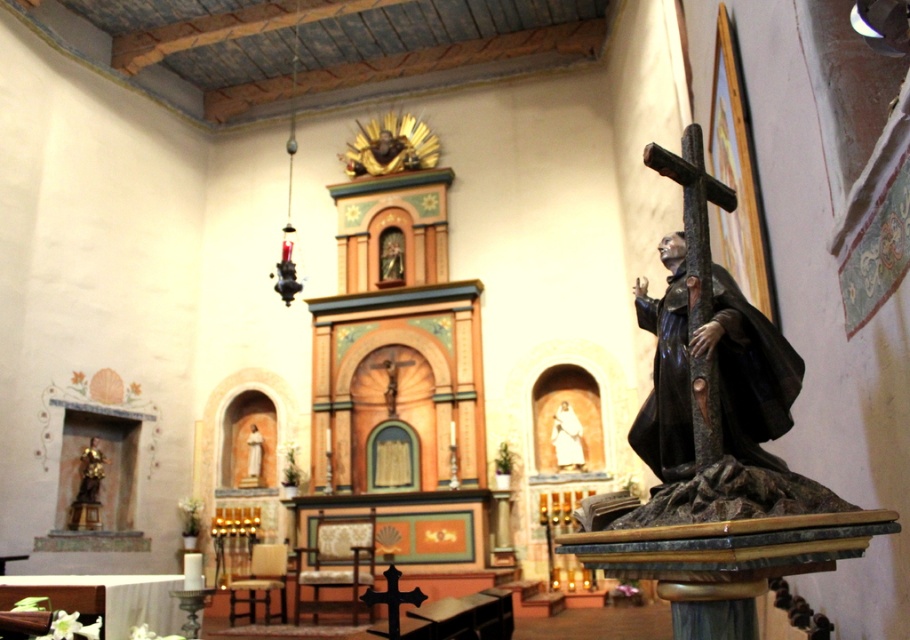
You are an interior designer planning to place a new decorative item in the church. You have a small statue that needs to fit between the polished dark wood statue at right and the gold leaf statue at upper center. Based on their sizes, which statue can you place closer to the new item without overcrowding the space?

The polished dark wood statue at right occupies less space than the gold leaf statue at upper center, so you can place the new item closer to the polished dark wood statue at right to avoid overcrowding.

You are standing in the center of the church and want to place a bouquet of flowers directly in front of the polished dark wood statue at right. Based on the statue

The polished dark wood statue at right is located at point [749,372], so you should place the bouquet of flowers at the coordinates closest to this point to position it directly in front of the statue.

You are an interior designer planning to place a new decorative item in the church. You have two options from the scene, the white cloth figure at center and the smooth white statue at center. If you want to choose the bigger one for a prominent display, which should you select?

The white cloth figure at center is larger in size than the smooth white statue at center, so you should select the white cloth figure at center for a prominent display.